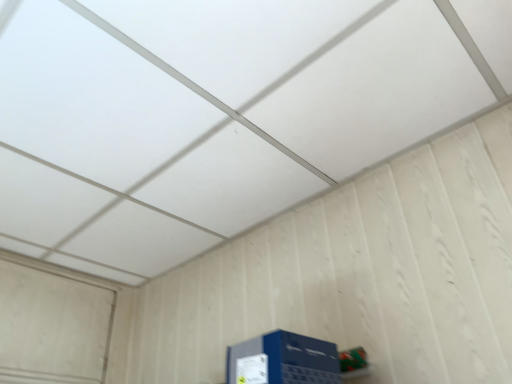
What do you see at coordinates (283, 360) in the screenshot?
I see `blue cardboard box at lower right` at bounding box center [283, 360].

The image size is (512, 384). Identify the location of blue cardboard box at lower right. (283, 360).

In the scene shown: Measure the distance between blue cardboard box at lower right and camera.

They are 92.44 centimeters apart.

This screenshot has width=512, height=384. Identify the location of blue cardboard box at lower right. (283, 360).